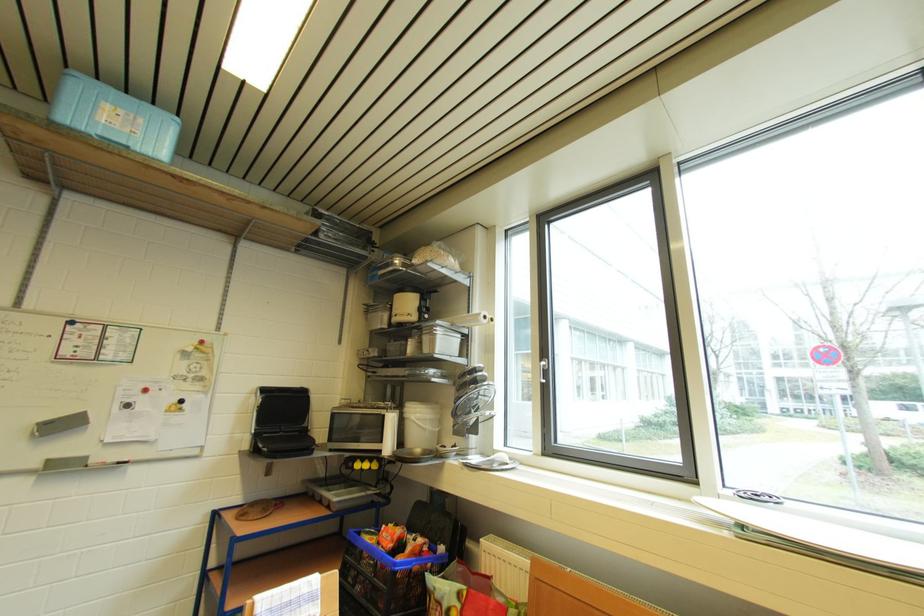
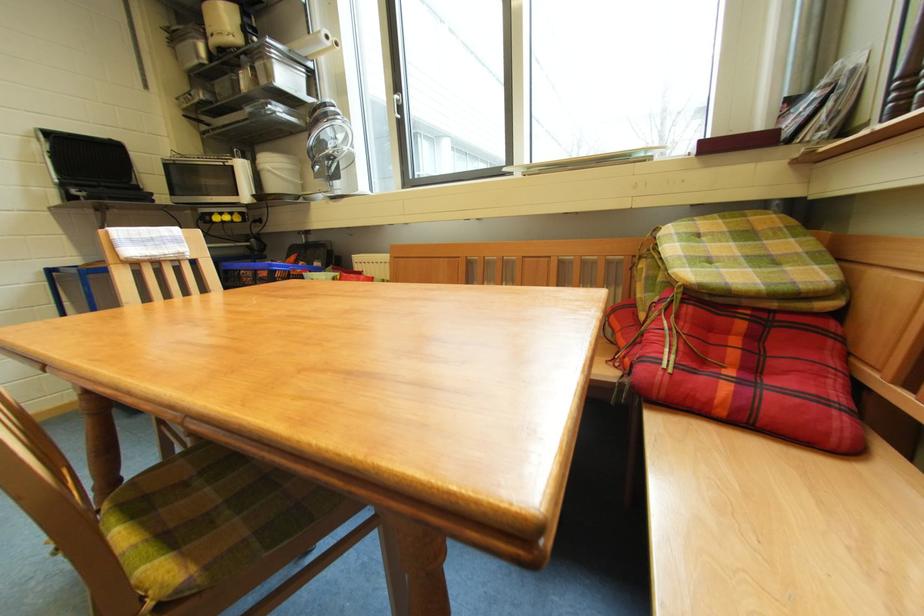
In the second image, find the point that corresponds to (x=423, y=422) in the first image.

(281, 171)